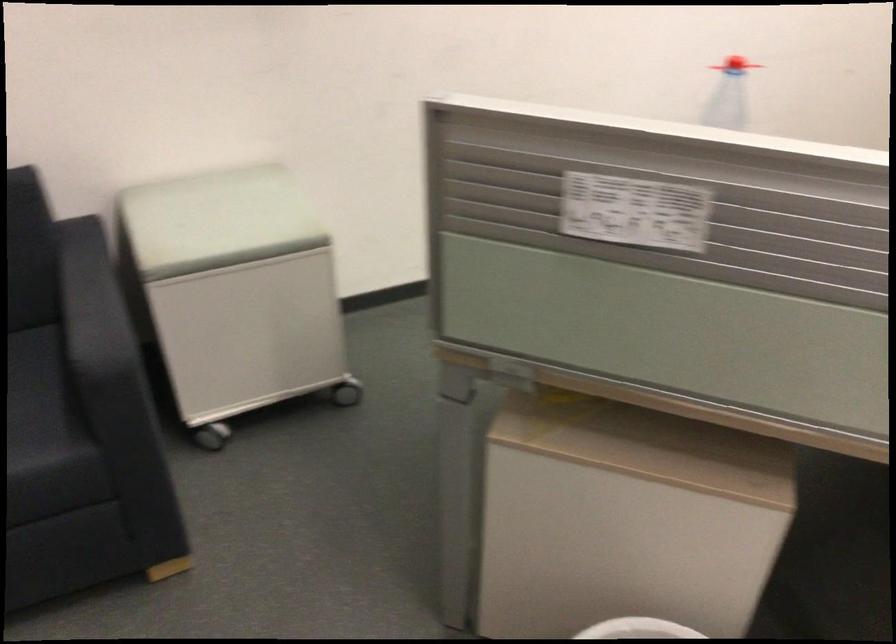
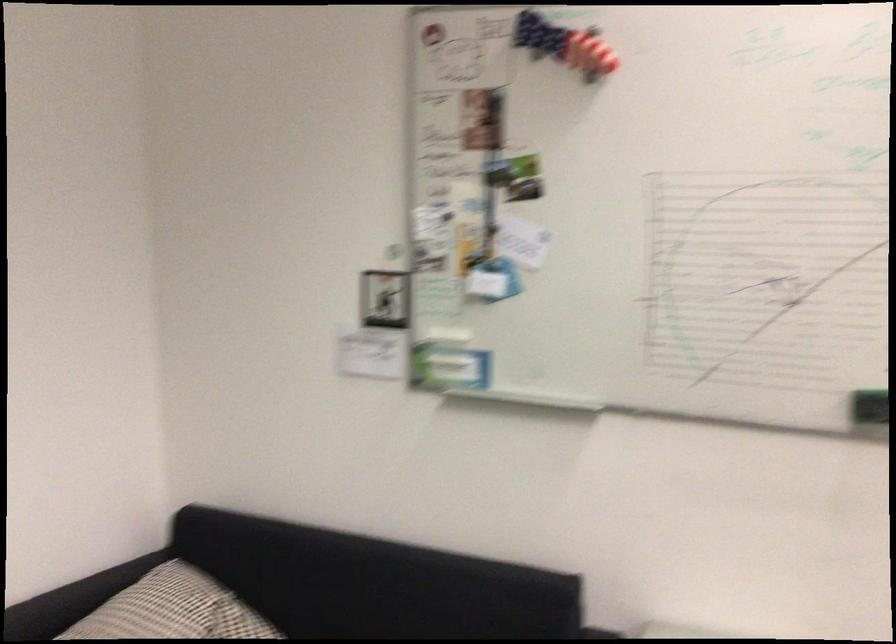
The images are taken continuously from a first-person perspective. In which direction is your viewpoint rotating?

The camera rotated toward left-up.